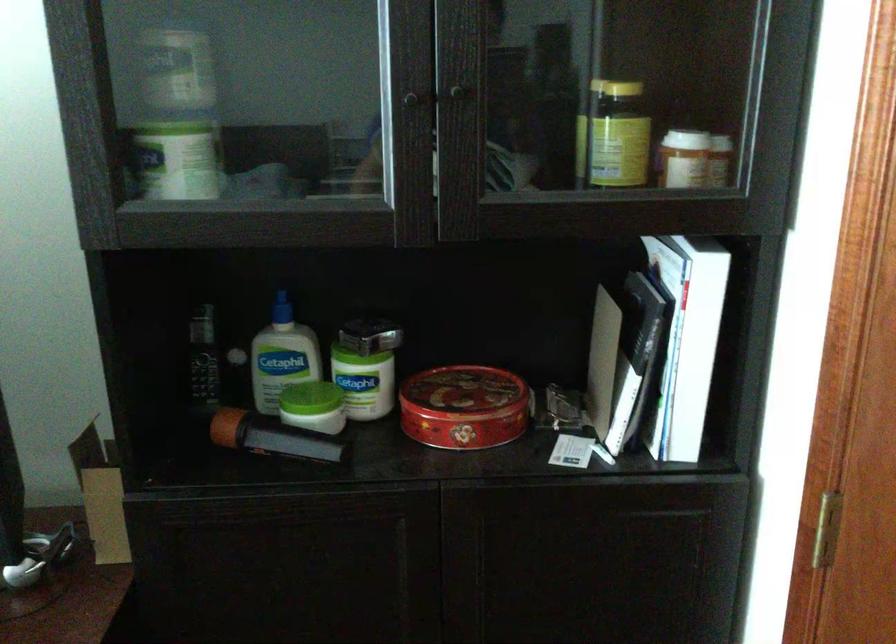
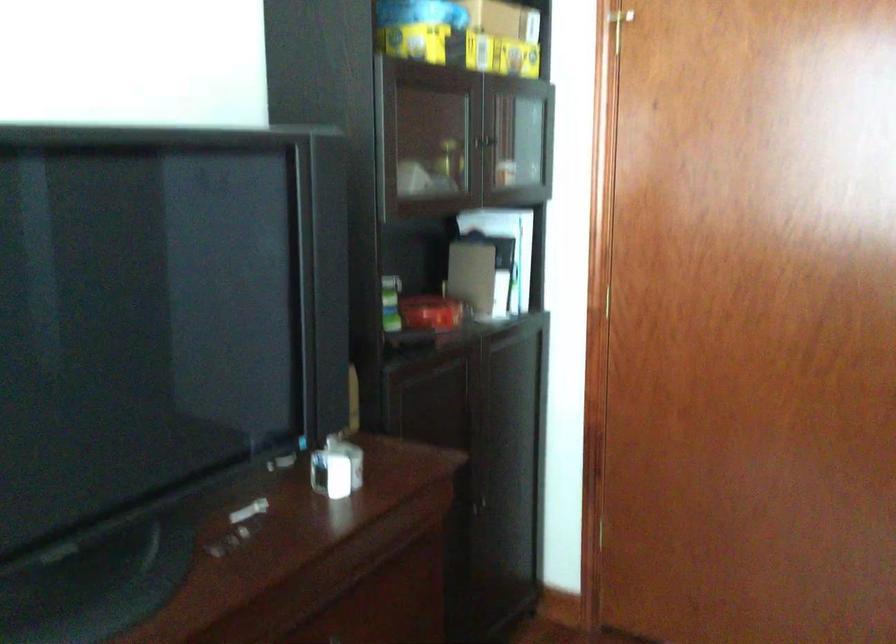
Locate, in the second image, the point that corresponds to the point at 642,368 in the first image.

(503, 272)